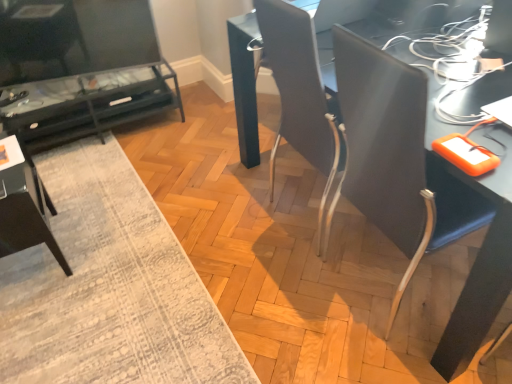
The width and height of the screenshot is (512, 384). In order to click on vacant area that lies to the right of textured gray rug at lower left in this screenshot , I will do `click(252, 241)`.